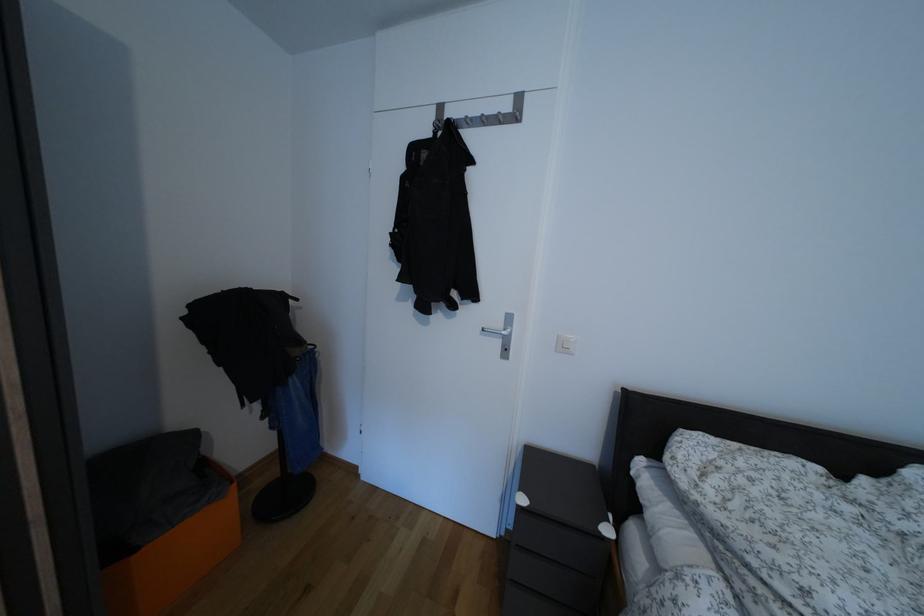
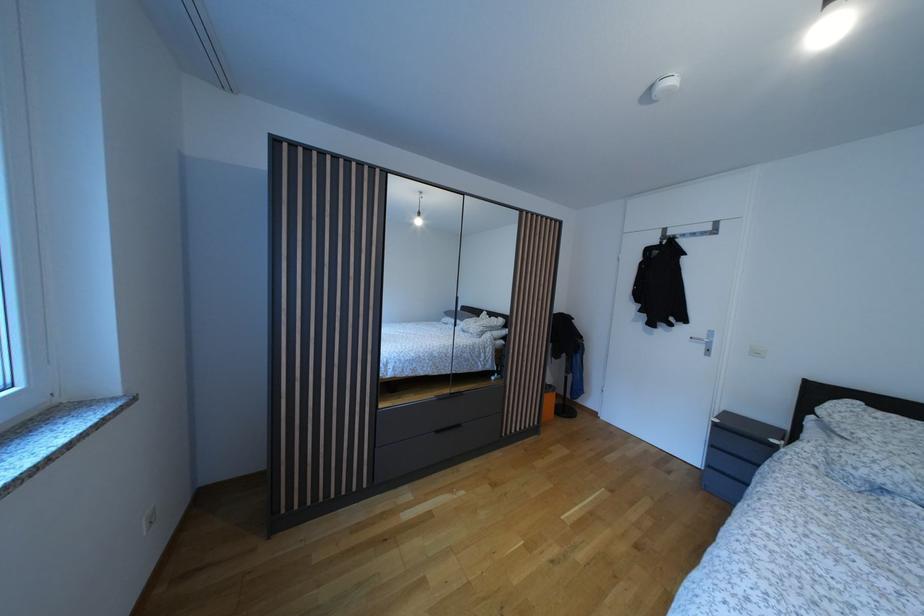
In the second image, find the point that corresponds to the point at 505,329 in the first image.

(709, 342)